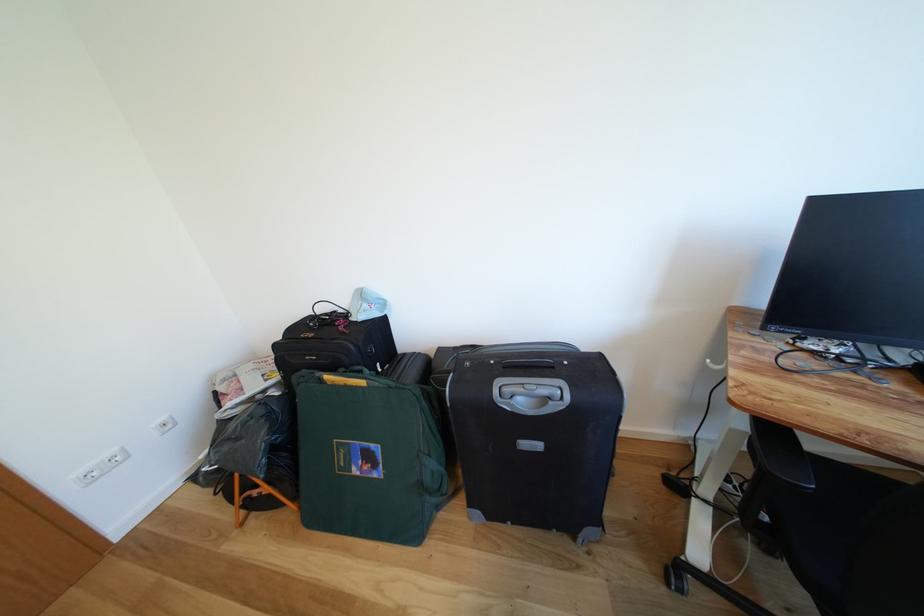
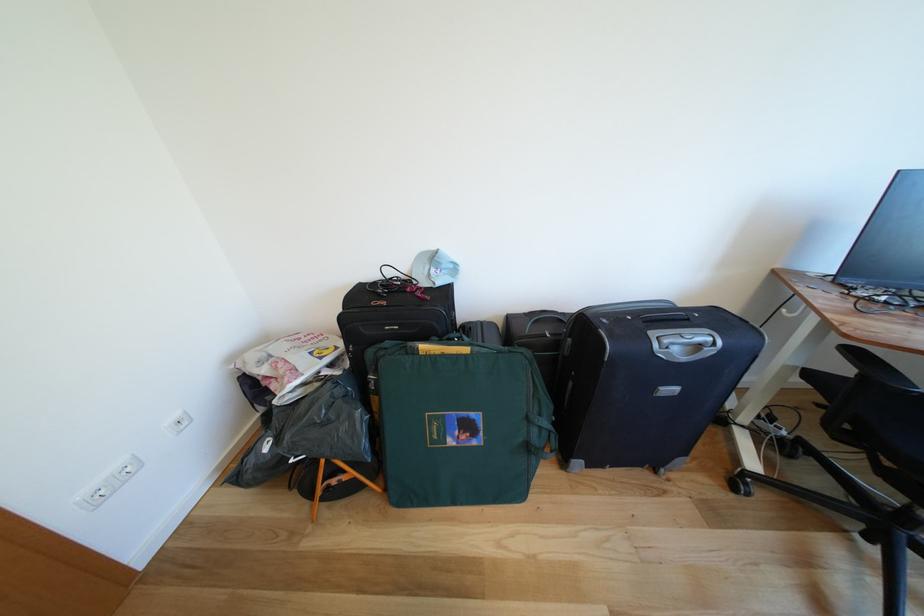
Question: How did the camera likely rotate?

Choices:
 (A) Left
 (B) Right
 (C) Up
 (D) Down

Answer: (B)